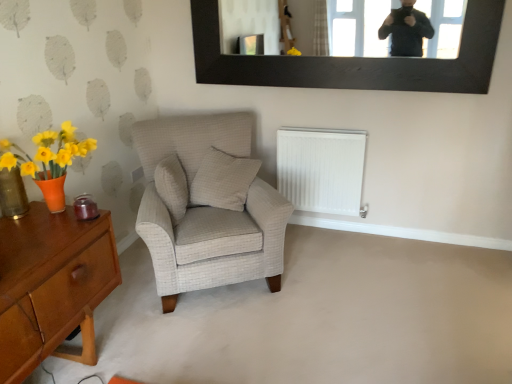
This screenshot has width=512, height=384. What are the coordinates of `free space in front of light gray fabric armchair at center` in the screenshot? It's located at (233, 338).